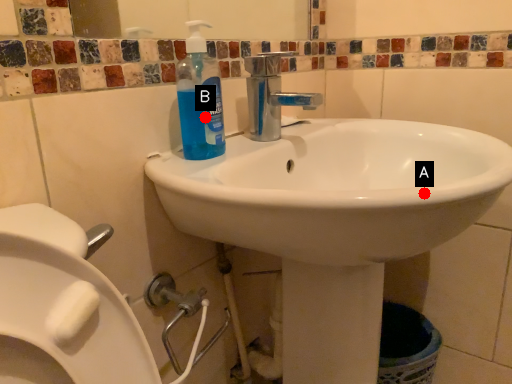
Question: Two points are circled on the image, labeled by A and B beside each circle. Which of the following is the farthest from the observer?

Choices:
 (A) A is further
 (B) B is further

Answer: (B)